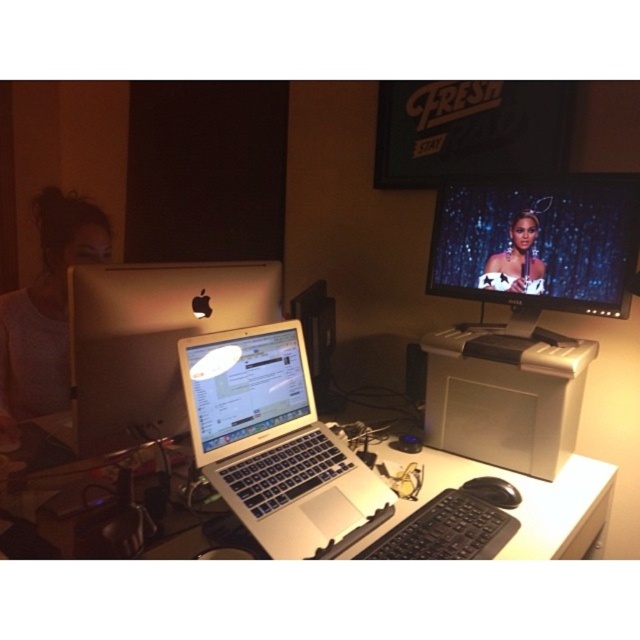
Question: Is matte gray hair at left positioned at the back of satin gold dress at upper center?

Choices:
 (A) yes
 (B) no

Answer: (B)

Question: Does satin silver monitor at upper right appear over matte black monitor at upper right?

Choices:
 (A) yes
 (B) no

Answer: (B)

Question: Is white plastic printer at center bigger than white plastic computer desk at center?

Choices:
 (A) no
 (B) yes

Answer: (A)

Question: Considering the real-world distances, which object is farthest from the satin gold dress at upper center?

Choices:
 (A) matte gray hair at left
 (B) silver metallic laptop at center

Answer: (A)

Question: Which of these objects is positioned farthest from the matte black monitor at upper right?

Choices:
 (A) satin silver monitor at upper right
 (B) white plastic computer desk at center
 (C) silver metallic laptop at center
 (D) sleek silver laptop at center

Answer: (D)

Question: Among these points, which one is nearest to the camera?

Choices:
 (A) (518, 216)
 (B) (86, 333)
 (C) (572, 234)
 (D) (561, 504)

Answer: (B)